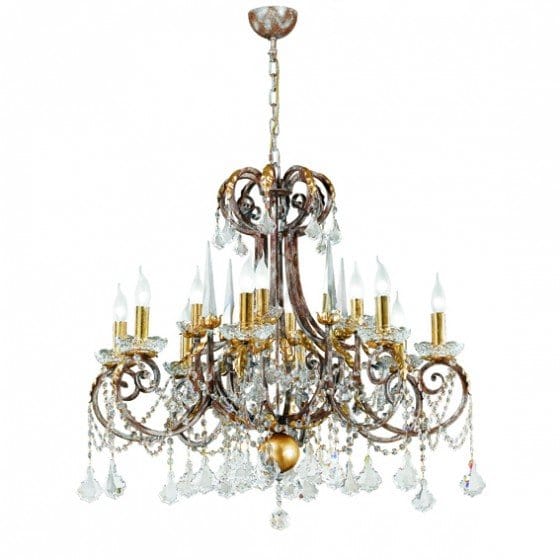
You are a GUI agent. You are given a task and a screenshot of the screen. Output one action in this format:
    pyautogui.click(x=<x>, y=<y>)
    Task: Click on the light
    
    Given the screenshot: What is the action you would take?
    pyautogui.click(x=144, y=300), pyautogui.click(x=116, y=316), pyautogui.click(x=194, y=298), pyautogui.click(x=249, y=288), pyautogui.click(x=269, y=282), pyautogui.click(x=361, y=290), pyautogui.click(x=382, y=292), pyautogui.click(x=436, y=302), pyautogui.click(x=398, y=320)